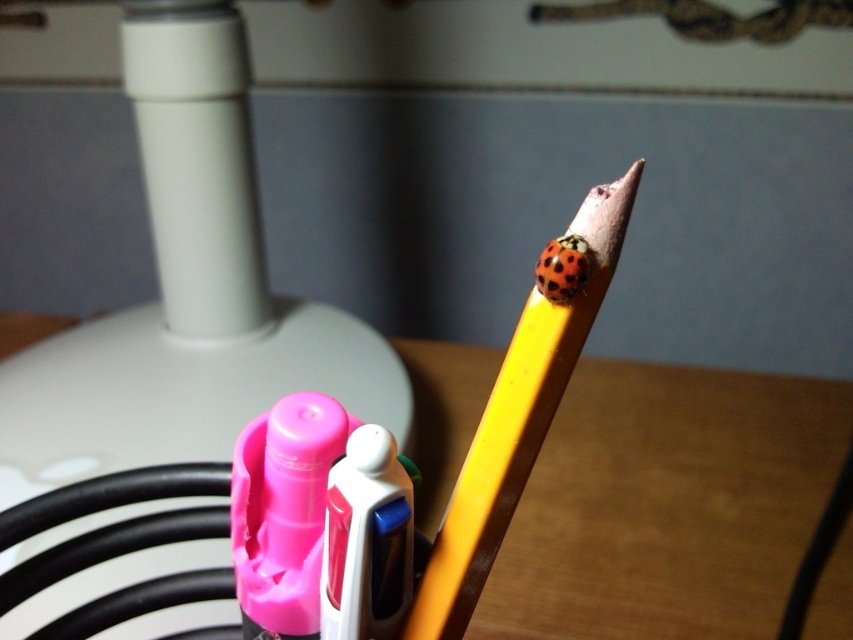
Question: Which of the following is the closest to the observer?

Choices:
 (A) (753, 392)
 (B) (509, 355)

Answer: (B)

Question: In this image, where is wooden table at center located relative to yellow wood pencil at upper center?

Choices:
 (A) left
 (B) right

Answer: (B)

Question: Which of the following is the farthest from the observer?

Choices:
 (A) (540, 429)
 (B) (4, 337)

Answer: (B)

Question: Observing the image, what is the correct spatial positioning of wooden table at center in reference to yellow wood pencil at upper center?

Choices:
 (A) above
 (B) below

Answer: (B)

Question: Is wooden table at center positioned in front of yellow wood pencil at upper center?

Choices:
 (A) no
 (B) yes

Answer: (A)

Question: Which object appears closest to the camera in this image?

Choices:
 (A) wooden table at center
 (B) yellow wood pencil at upper center

Answer: (B)